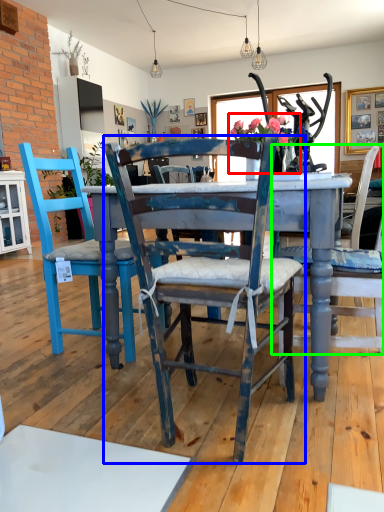
Question: Which is nearer to the floral arrangement (highlighted by a red box)? chair (highlighted by a blue box) or chair (highlighted by a green box).

Choices:
 (A) chair
 (B) chair

Answer: (B)